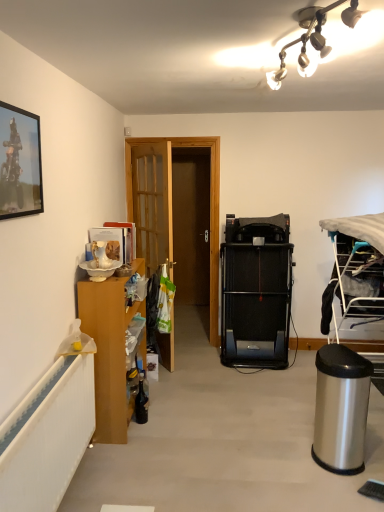
Question: From the image's perspective, does silver metallic trash can at lower right appear higher than silver metallic trash can at lower right?

Choices:
 (A) no
 (B) yes

Answer: (A)

Question: Does silver metallic trash can at lower right have a larger size compared to silver metallic trash can at lower right?

Choices:
 (A) yes
 (B) no

Answer: (B)

Question: Is silver metallic trash can at lower right at the left side of silver metallic trash can at lower right?

Choices:
 (A) yes
 (B) no

Answer: (A)

Question: Is silver metallic trash can at lower right smaller than silver metallic trash can at lower right?

Choices:
 (A) yes
 (B) no

Answer: (A)

Question: From a real-world perspective, is silver metallic trash can at lower right physically above silver metallic trash can at lower right?

Choices:
 (A) yes
 (B) no

Answer: (B)

Question: Does silver metallic trash can at lower right have a greater height compared to silver metallic trash can at lower right?

Choices:
 (A) no
 (B) yes

Answer: (A)

Question: Can you confirm if metallic silver picture frame at upper left is thinner than black rubber treadmill at center?

Choices:
 (A) yes
 (B) no

Answer: (A)

Question: From the image's perspective, is metallic silver picture frame at upper left under black rubber treadmill at center?

Choices:
 (A) yes
 (B) no

Answer: (B)

Question: From the image's perspective, does metallic silver picture frame at upper left appear higher than black rubber treadmill at center?

Choices:
 (A) no
 (B) yes

Answer: (B)

Question: Is metallic silver picture frame at upper left not near black rubber treadmill at center?

Choices:
 (A) yes
 (B) no

Answer: (A)

Question: Considering the relative sizes of metallic silver picture frame at upper left and black rubber treadmill at center in the image provided, is metallic silver picture frame at upper left smaller than black rubber treadmill at center?

Choices:
 (A) yes
 (B) no

Answer: (A)

Question: Is black rubber treadmill at center a part of metallic silver picture frame at upper left?

Choices:
 (A) yes
 (B) no

Answer: (B)

Question: Does wooden cabinet at left have a smaller size compared to metallic silver picture frame at upper left?

Choices:
 (A) no
 (B) yes

Answer: (A)